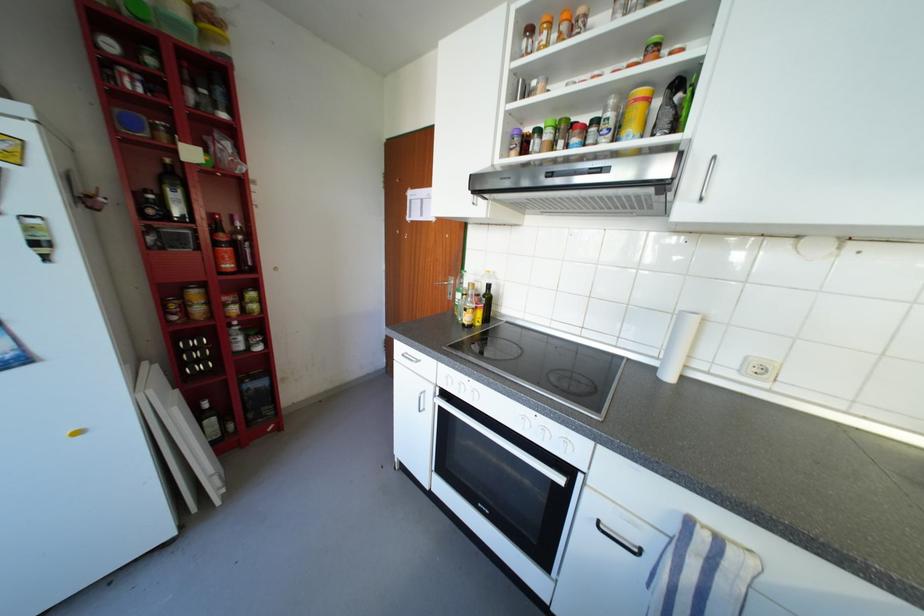
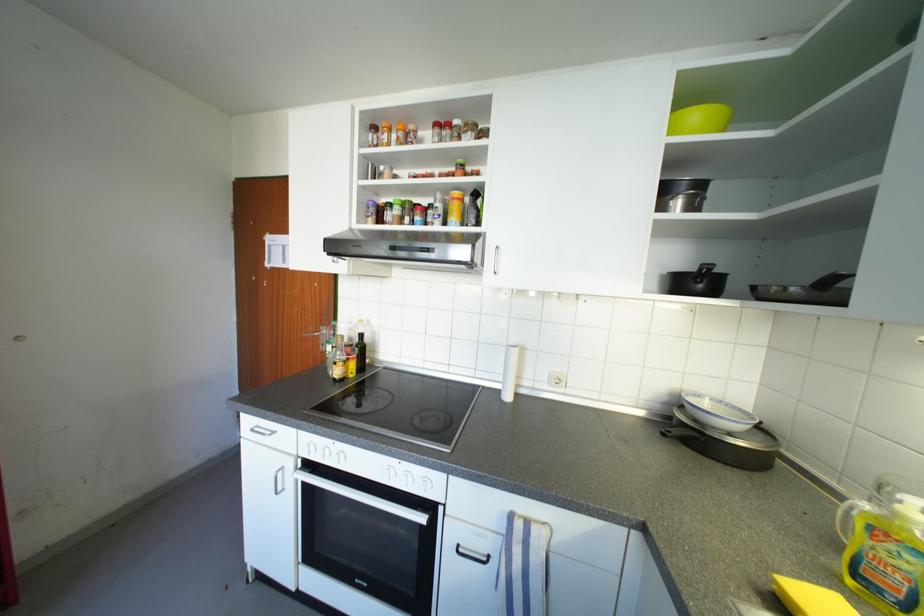
The images are taken continuously from a first-person perspective. In which direction are you moving?

The movement direction of the cameraman is right, backward.